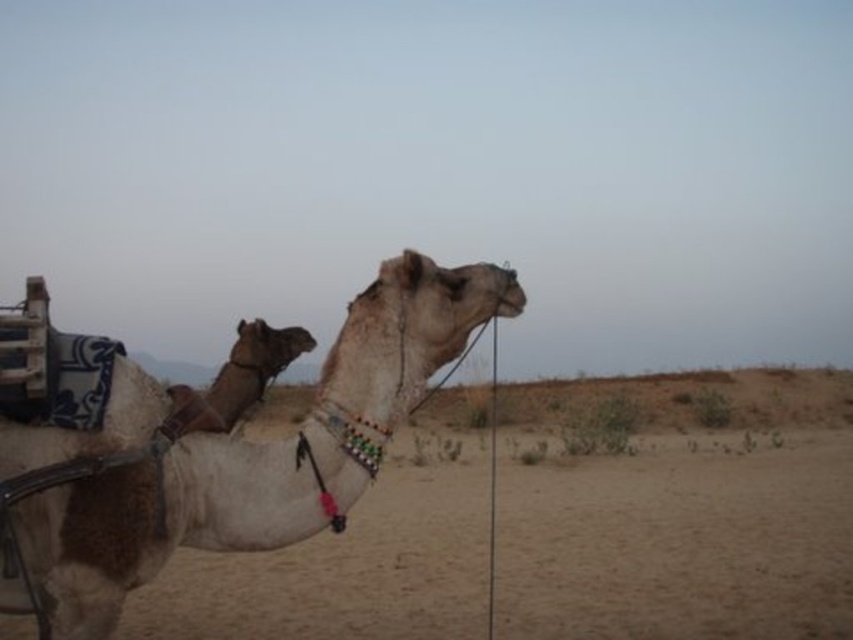
Is point (692, 529) behind point (33, 499)?

Yes, point (692, 529) is behind point (33, 499).

Can you confirm if white sand camel at center is positioned above white matte camel at center?

No.

Where is `white sand camel at center`? This screenshot has width=853, height=640. white sand camel at center is located at coordinates (683, 528).